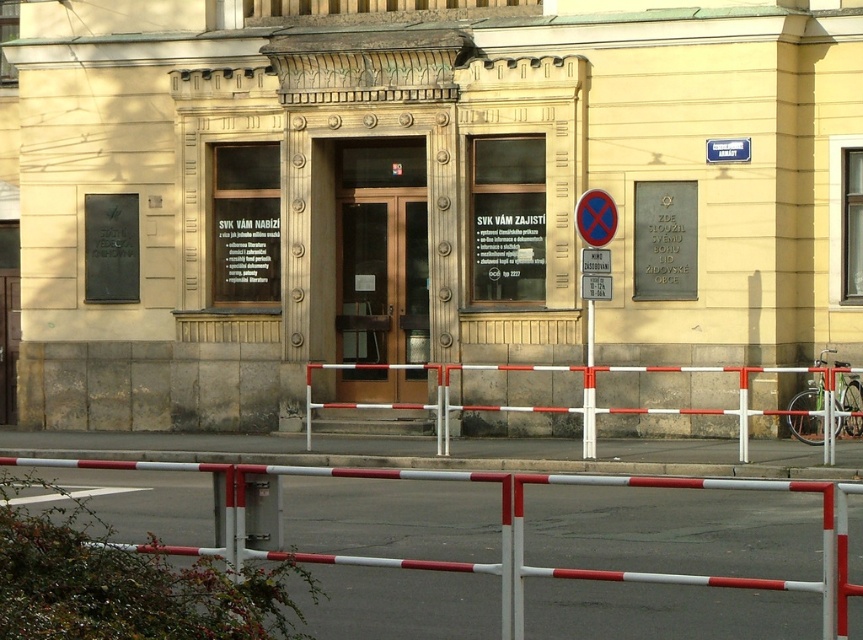
Question: Which of the following is the farthest from the observer?

Choices:
 (A) white plastic pole at center
 (B) bronze glass door at center

Answer: (B)

Question: Is the position of bronze glass door at center less distant than that of white plastic pole at center?

Choices:
 (A) no
 (B) yes

Answer: (A)

Question: Is bronze glass door at center above matte red circle at center?

Choices:
 (A) no
 (B) yes

Answer: (A)

Question: Among these points, which one is nearest to the camera?

Choices:
 (A) (838, 636)
 (B) (413, 353)
 (C) (593, 220)
 (D) (587, 451)

Answer: (A)

Question: Which point is closer to the camera?

Choices:
 (A) white metal barricade at center
 (B) white/red striped barrier at center

Answer: (B)

Question: Can you confirm if white/red striped barrier at center is thinner than white metal barricade at center?

Choices:
 (A) yes
 (B) no

Answer: (B)